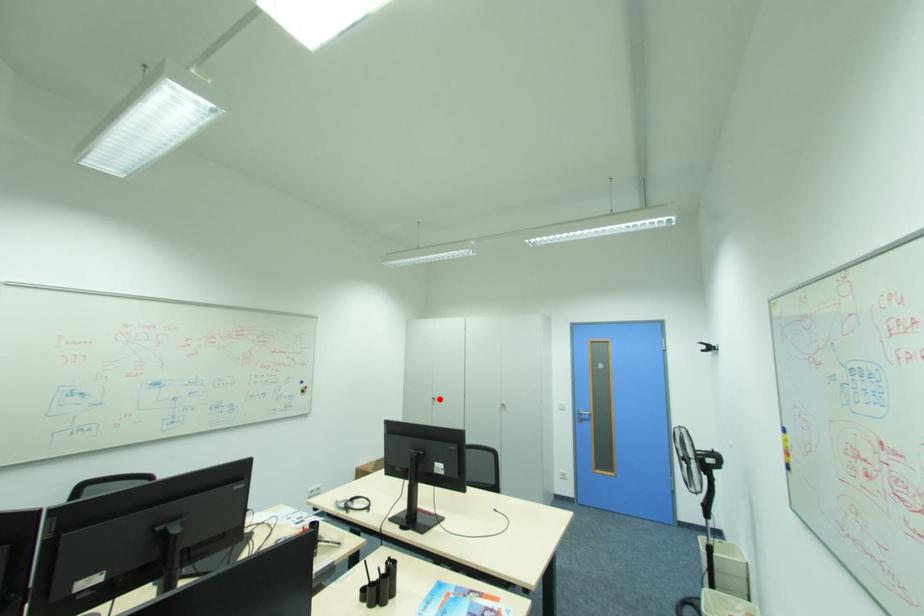
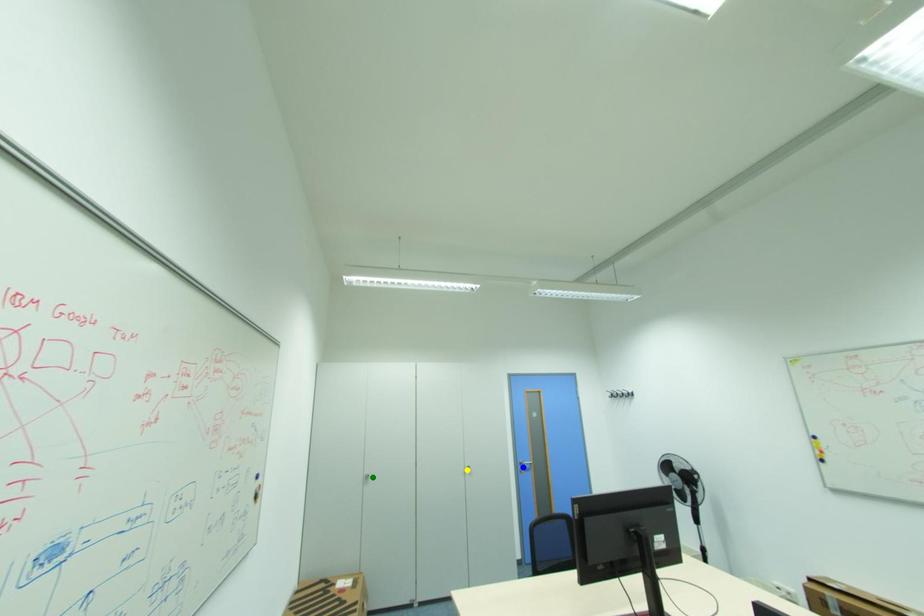
Question: I am providing you with two images of the same scene from different viewpoints. A red point is marked on the first image. You are given multiple points on the second image. Which point in image 2 is actually the same real-world point as the red point in image 1?

Choices:
 (A) blue point
 (B) yellow point
 (C) green point

Answer: (C)